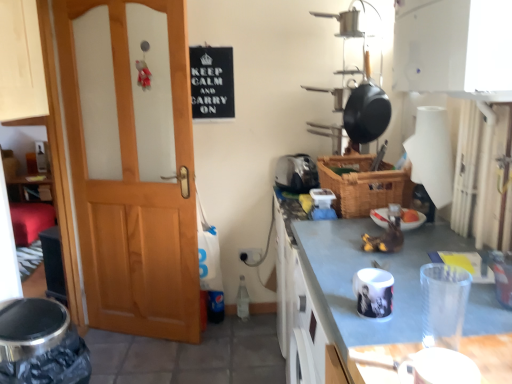
Locate an element on the screen. The image size is (512, 384). blank space above white glossy plate at center, placed as the third appliance when sorted from bottom to top (from a real-world perspective) is located at coordinates (397, 209).